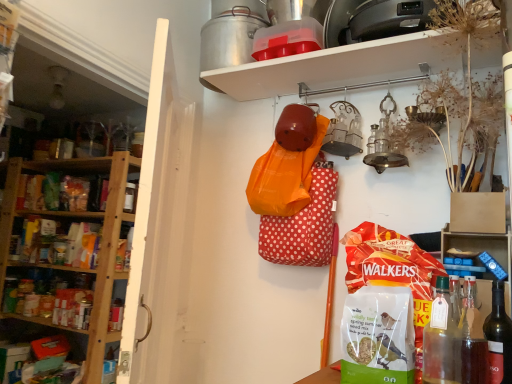
The width and height of the screenshot is (512, 384). What are the coordinates of `free space above metallic silver at upper center, marked as the 2th shelf in a left-to-right arrangement (from a real-world perspective)` in the screenshot? It's located at (346, 64).